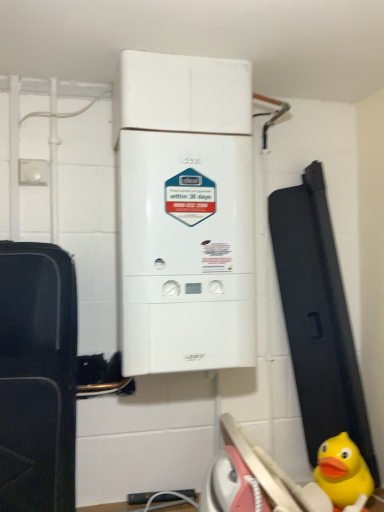
Question: Can you confirm if white matte boiler at center is smaller than yellow rubber duck at lower right?

Choices:
 (A) no
 (B) yes

Answer: (A)

Question: Is white matte boiler at center outside yellow rubber duck at lower right?

Choices:
 (A) yes
 (B) no

Answer: (A)

Question: Considering the relative sizes of white matte boiler at center and yellow rubber duck at lower right in the image provided, is white matte boiler at center thinner than yellow rubber duck at lower right?

Choices:
 (A) no
 (B) yes

Answer: (A)

Question: Is yellow rubber duck at lower right a part of white matte boiler at center?

Choices:
 (A) yes
 (B) no

Answer: (B)

Question: Is white matte boiler at center positioned before yellow rubber duck at lower right?

Choices:
 (A) no
 (B) yes

Answer: (B)

Question: Does white matte boiler at center turn towards yellow rubber duck at lower right?

Choices:
 (A) no
 (B) yes

Answer: (A)

Question: From a real-world perspective, does yellow rubber duck at lower right stand above white matte boiler at center?

Choices:
 (A) yes
 (B) no

Answer: (B)

Question: Would you consider yellow rubber duck at lower right to be distant from white matte boiler at center?

Choices:
 (A) yes
 (B) no

Answer: (B)

Question: From the image's perspective, is yellow rubber duck at lower right located above white matte boiler at center?

Choices:
 (A) yes
 (B) no

Answer: (B)

Question: Is yellow rubber duck at lower right smaller than white matte boiler at center?

Choices:
 (A) no
 (B) yes

Answer: (B)

Question: Is the depth of yellow rubber duck at lower right greater than that of white matte boiler at center?

Choices:
 (A) no
 (B) yes

Answer: (B)

Question: Is yellow rubber duck at lower right wider than white matte boiler at center?

Choices:
 (A) yes
 (B) no

Answer: (B)

Question: From their relative heights in the image, would you say white matte boiler at center is taller or shorter than yellow rubber duck at lower right?

Choices:
 (A) short
 (B) tall

Answer: (B)